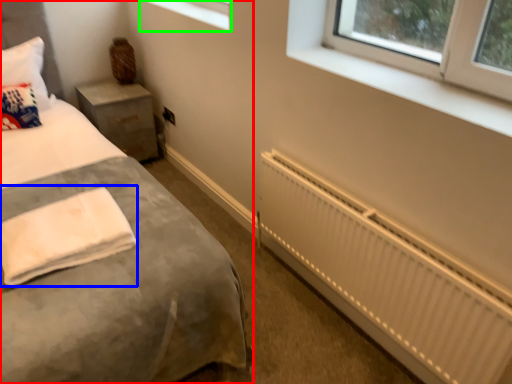
Question: Which object is the farthest from bed (highlighted by a red box)? Choose among these: cloth (highlighted by a blue box) or window (highlighted by a green box).

Choices:
 (A) cloth
 (B) window

Answer: (B)